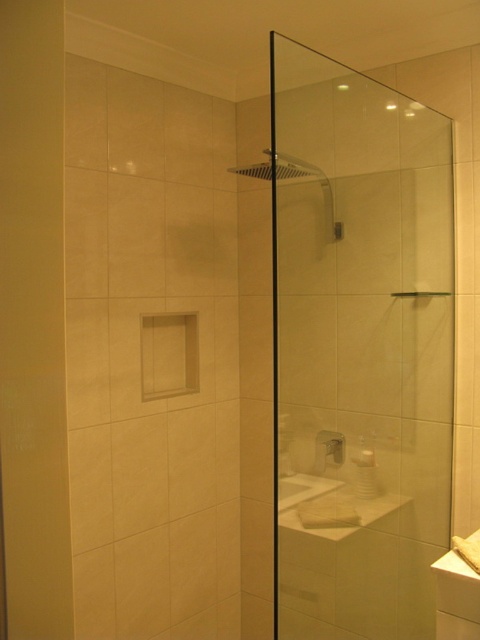
Can you confirm if transparent glass screen door at left is positioned above white glossy sink at lower right?

Yes.

Consider the image. Is transparent glass screen door at left to the right of white glossy sink at lower right from the viewer's perspective?

In fact, transparent glass screen door at left is to the left of white glossy sink at lower right.

Image resolution: width=480 pixels, height=640 pixels. Find the location of `transparent glass screen door at left`. transparent glass screen door at left is located at coordinates (33, 323).

Looking at this image, between transparent glass shower door at center and white glossy sink at lower right, which one is positioned lower?

Positioned lower is white glossy sink at lower right.

Can you confirm if transparent glass shower door at center is positioned below white glossy sink at lower right?

Incorrect, transparent glass shower door at center is not positioned below white glossy sink at lower right.

Image resolution: width=480 pixels, height=640 pixels. In order to click on transparent glass shower door at center in this screenshot , I will do `click(360, 349)`.

In the scene shown: Between transparent glass shower door at center and transparent glass screen door at left, which one appears on the right side from the viewer's perspective?

Positioned to the right is transparent glass shower door at center.

Consider the image. Who is more distant from viewer, [361,588] or [23,364]?

Positioned behind is point [361,588].

Measure the distance between point (356, 166) and camera.

They are 1.89 meters apart.

At what (x,y) coordinates should I click in order to perform the action: click on transparent glass shower door at center. Please return your answer as a coordinate pair (x, y). Looking at the image, I should click on (360, 349).